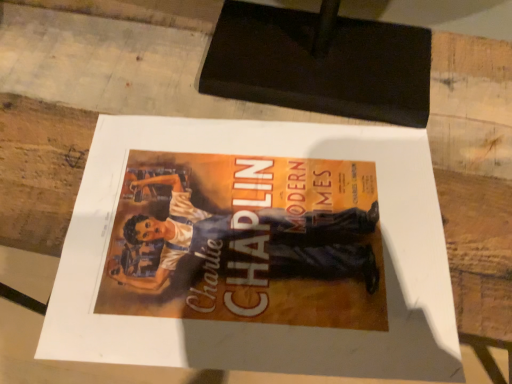
Find the location of a particular element. This screenshot has height=384, width=512. matte paper poster at center is located at coordinates (256, 251).

The image size is (512, 384). What do you see at coordinates (256, 251) in the screenshot?
I see `matte paper poster at center` at bounding box center [256, 251].

Measure the distance between matte paper poster at center and camera.

A distance of 11.11 inches exists between matte paper poster at center and camera.

Where is `matte paper poster at center`? The height and width of the screenshot is (384, 512). matte paper poster at center is located at coordinates (256, 251).